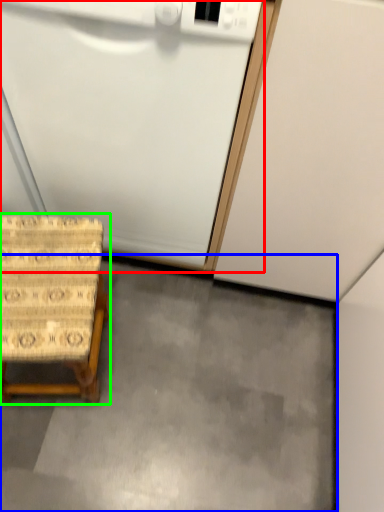
Question: Considering the real-world distances, which object is closest to appliance (highlighted by a red box)? concrete (highlighted by a blue box) or furniture (highlighted by a green box).

Choices:
 (A) concrete
 (B) furniture

Answer: (B)